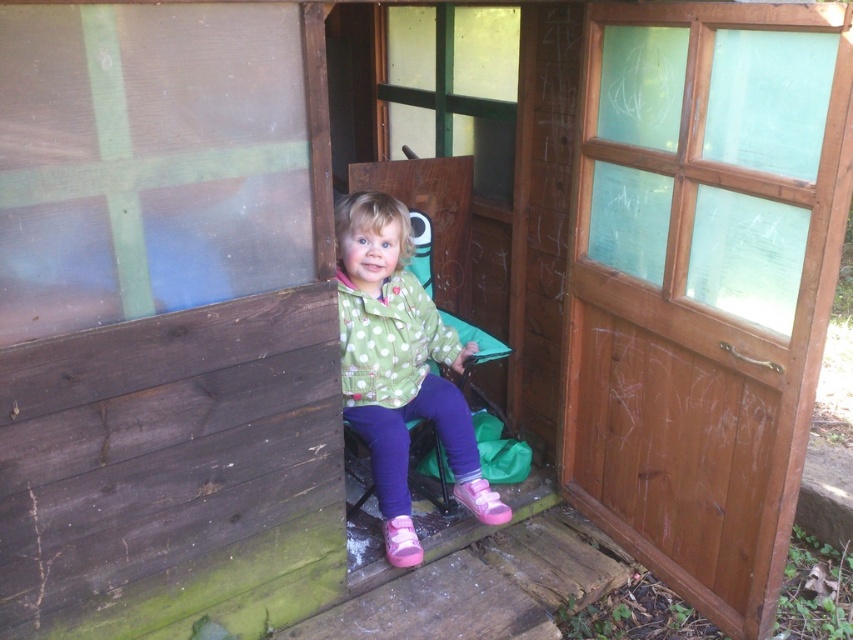
The height and width of the screenshot is (640, 853). What do you see at coordinates (704, 284) in the screenshot?
I see `wooden screen door at center` at bounding box center [704, 284].

Is wooden screen door at center above green polka dot jacket at center?

Yes, wooden screen door at center is above green polka dot jacket at center.

Does point (817, 205) come in front of point (370, 269)?

Yes, it is in front of point (370, 269).

Locate an element on the screen. The image size is (853, 640). wooden screen door at center is located at coordinates (704, 284).